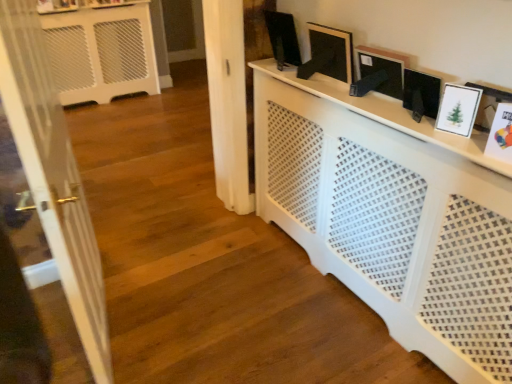
What do you see at coordinates (458, 109) in the screenshot? This screenshot has width=512, height=384. I see `white glossy picture frame at upper right, which is the 2th picture frame from front to back` at bounding box center [458, 109].

At what (x,y) coordinates should I click in order to perform the action: click on matte black picture frame at upper center, acting as the 5th picture frame starting from the front. Please return your answer as a coordinate pair (x, y). Looking at the image, I should click on (283, 38).

What is the approximate width of white matte picture frame at upper right, the 3th picture frame when ordered from right to left?

white matte picture frame at upper right, the 3th picture frame when ordered from right to left, is 4.86 inches in width.

Measure the distance between point (408,69) and camera.

Point (408,69) and camera are 4.94 feet apart.

Where is `white paper picture frame at right, which is counted as the fifth picture frame, starting from the left`? white paper picture frame at right, which is counted as the fifth picture frame, starting from the left is located at coordinates (501, 134).

The width and height of the screenshot is (512, 384). Describe the element at coordinates (391, 221) in the screenshot. I see `white perforated radiator at center` at that location.

Find the location of a particular element. white glossy picture frame at upper right, which is the 2th picture frame from front to back is located at coordinates (458, 109).

From the image's perspective, which one is positioned higher, white perforated radiator at center or white paper picture frame at right, which is the fifth picture frame from back to front?

white paper picture frame at right, which is the fifth picture frame from back to front, appears higher in the image.

What's the angular difference between white perforated radiator at center and white paper picture frame at right, which is the first picture frame in front-to-back order,'s facing directions?

The facing directions of white perforated radiator at center and white paper picture frame at right, which is the first picture frame in front-to-back order, are 0.00296 degrees apart.

Is white perforated radiator at center oriented towards white paper picture frame at right, which is counted as the fifth picture frame, starting from the left?

No, white perforated radiator at center is not turned towards white paper picture frame at right, which is counted as the fifth picture frame, starting from the left.

Between white perforated radiator at center and white paper picture frame at right, which is the first picture frame in front-to-back order, which one has more height?

With more height is white perforated radiator at center.

From a real-world perspective, which is physically above, white paper picture frame at right, which is the fifth picture frame from back to front, or black matte picture frame at upper center, which is counted as the 4th picture frame, starting from the front?

In real-world perspective, black matte picture frame at upper center, which is counted as the 4th picture frame, starting from the front, is above.

Is white paper picture frame at right, positioned as the first picture frame in right-to-left order, at the right side of black matte picture frame at upper center, placed as the fourth picture frame when sorted from right to left?

Yes.

Does point (503, 124) come closer to viewer compared to point (310, 65)?

Yes.

Does white paper picture frame at right, which is the fifth picture frame from back to front, have a lesser width compared to black matte picture frame at upper center, which is the second picture frame from left to right?

In fact, white paper picture frame at right, which is the fifth picture frame from back to front, might be wider than black matte picture frame at upper center, which is the second picture frame from left to right.

From the picture: Who is bigger, white matte picture frame at upper right, which is the 3th picture frame in left-to-right order, or black matte picture frame at upper center, which is the second picture frame from left to right?

black matte picture frame at upper center, which is the second picture frame from left to right, is bigger.

Which point is more forward, (407, 74) or (318, 38)?

The point (407, 74) is more forward.

Is white matte picture frame at upper right, which is the 3th picture frame in left-to-right order, in front of or behind black matte picture frame at upper center, positioned as the 2th picture frame in back-to-front order, in the image?

white matte picture frame at upper right, which is the 3th picture frame in left-to-right order, is in front of black matte picture frame at upper center, positioned as the 2th picture frame in back-to-front order.

From the image's perspective, is white glossy picture frame at upper right, the 4th picture frame from the left, on top of matte black picture frame at upper center, acting as the 5th picture frame starting from the front?

Actually, white glossy picture frame at upper right, the 4th picture frame from the left, appears below matte black picture frame at upper center, acting as the 5th picture frame starting from the front, in the image.

Consider the image. Considering their positions, is white glossy picture frame at upper right, the 4th picture frame from the left, located in front of or behind matte black picture frame at upper center, acting as the 1th picture frame starting from the back?

white glossy picture frame at upper right, the 4th picture frame from the left, is in front of matte black picture frame at upper center, acting as the 1th picture frame starting from the back.

Is white glossy picture frame at upper right, which is the fourth picture frame in back-to-front order, touching matte black picture frame at upper center, the first picture frame when ordered from left to right?

They are not placed beside each other.

Considering the relative sizes of white glossy picture frame at upper right, the 4th picture frame from the left, and matte black picture frame at upper center, acting as the 5th picture frame starting from the front, in the image provided, is white glossy picture frame at upper right, the 4th picture frame from the left, wider than matte black picture frame at upper center, acting as the 5th picture frame starting from the front,?

No.

Which is more to the right, white glossy picture frame at upper right, which is counted as the second picture frame, starting from the right, or white glossy door at left?

white glossy picture frame at upper right, which is counted as the second picture frame, starting from the right, is more to the right.

Between white glossy picture frame at upper right, which is the 2th picture frame from front to back, and white glossy door at left, which one has less height?

With less height is white glossy picture frame at upper right, which is the 2th picture frame from front to back.

Is white glossy picture frame at upper right, which is the fourth picture frame in back-to-front order, not within white glossy door at left?

Indeed, white glossy picture frame at upper right, which is the fourth picture frame in back-to-front order, is completely outside white glossy door at left.

Is white glossy door at left completely or partially inside white paper picture frame at right, which is the first picture frame in front-to-back order?

Actually, white glossy door at left is outside white paper picture frame at right, which is the first picture frame in front-to-back order.

Is white paper picture frame at right, which is the first picture frame in front-to-back order, positioned before white glossy door at left?

No.

Between white paper picture frame at right, positioned as the first picture frame in right-to-left order, and white glossy door at left, which one has larger size?

white glossy door at left is bigger.

Locate an element on the screen. This screenshot has height=384, width=512. the 1st picture frame behind the white glossy door at left, starting your count from the anchor is located at coordinates (501, 134).

Are white glossy picture frame at upper right, which is the 2th picture frame from front to back, and black matte picture frame at upper center, which is counted as the 4th picture frame, starting from the front, beside each other?

They are not placed beside each other.

Is white glossy picture frame at upper right, which is counted as the second picture frame, starting from the right, aimed at black matte picture frame at upper center, which is the second picture frame from left to right?

No, white glossy picture frame at upper right, which is counted as the second picture frame, starting from the right, is not oriented towards black matte picture frame at upper center, which is the second picture frame from left to right.

Is black matte picture frame at upper center, which is the second picture frame from left to right, surrounded by white glossy picture frame at upper right, which is counted as the second picture frame, starting from the right?

No, black matte picture frame at upper center, which is the second picture frame from left to right, is located outside of white glossy picture frame at upper right, which is counted as the second picture frame, starting from the right.

Can you confirm if white glossy picture frame at upper right, which is counted as the second picture frame, starting from the right, is shorter than black matte picture frame at upper center, placed as the fourth picture frame when sorted from right to left?

Indeed, white glossy picture frame at upper right, which is counted as the second picture frame, starting from the right, has a lesser height compared to black matte picture frame at upper center, placed as the fourth picture frame when sorted from right to left.

At what (x,y) coordinates should I click in order to perform the action: click on furniture on the left side of white paper picture frame at right, which is the first picture frame in front-to-back order. Please return your answer as a coordinate pair (x, y). The image size is (512, 384). Looking at the image, I should click on (391, 221).

Starting from the black matte picture frame at upper center, placed as the fourth picture frame when sorted from right to left, which picture frame is the 3rd one in front? Please provide its 2D coordinates.

[(501, 134)]

Which object lies nearer to the anchor point white glossy door at left, white matte picture frame at upper right, which is the 3th picture frame from front to back, or matte black picture frame at upper center, acting as the 5th picture frame starting from the front?

matte black picture frame at upper center, acting as the 5th picture frame starting from the front, lies closer to white glossy door at left than the other object.

Which object lies nearer to the anchor point white glossy picture frame at upper right, which is the 2th picture frame from front to back, black matte picture frame at upper center, which is counted as the 4th picture frame, starting from the front, or white glossy door at left?

black matte picture frame at upper center, which is counted as the 4th picture frame, starting from the front, lies closer to white glossy picture frame at upper right, which is the 2th picture frame from front to back, than the other object.

When comparing their distances from black matte picture frame at upper center, which is the second picture frame from left to right, does white paper picture frame at right, which is the fifth picture frame from back to front, or matte black picture frame at upper center, acting as the 1th picture frame starting from the back, seem further?

white paper picture frame at right, which is the fifth picture frame from back to front, lies further to black matte picture frame at upper center, which is the second picture frame from left to right, than the other object.

Considering their positions, is white matte picture frame at upper right, which is the 3th picture frame from front to back, positioned closer to white paper picture frame at right, positioned as the first picture frame in right-to-left order, than white glossy picture frame at upper right, the 4th picture frame from the left?

Based on the image, white glossy picture frame at upper right, the 4th picture frame from the left, appears to be nearer to white paper picture frame at right, positioned as the first picture frame in right-to-left order.

From the image, which object appears to be nearer to matte black picture frame at upper center, acting as the 5th picture frame starting from the front, white glossy picture frame at upper right, the 4th picture frame from the left, or white paper picture frame at right, which is counted as the fifth picture frame, starting from the left?

white glossy picture frame at upper right, the 4th picture frame from the left, is closer to matte black picture frame at upper center, acting as the 5th picture frame starting from the front.

Based on their spatial positions, is white glossy picture frame at upper right, the 4th picture frame from the left, or matte black picture frame at upper center, acting as the 5th picture frame starting from the front, closer to white glossy door at left?

The object closer to white glossy door at left is matte black picture frame at upper center, acting as the 5th picture frame starting from the front.

Considering their positions, is black matte picture frame at upper center, which is counted as the 4th picture frame, starting from the front, positioned closer to white glossy picture frame at upper right, which is the fourth picture frame in back-to-front order, than white perforated radiator at center?

Among the two, white perforated radiator at center is located nearer to white glossy picture frame at upper right, which is the fourth picture frame in back-to-front order.

From the image, which object appears to be nearer to black matte picture frame at upper center, placed as the fourth picture frame when sorted from right to left, white glossy door at left or white perforated radiator at center?

Based on the image, white perforated radiator at center appears to be nearer to black matte picture frame at upper center, placed as the fourth picture frame when sorted from right to left.

Identify the location of furniture between white glossy door at left and white matte picture frame at upper right, the 3th picture frame positioned from the back, from left to right. This screenshot has width=512, height=384. click(x=391, y=221).

Where is `picture frame located between white glossy picture frame at upper right, the 4th picture frame from the left, and black matte picture frame at upper center, which is the second picture frame from left to right, in the depth direction`? The image size is (512, 384). picture frame located between white glossy picture frame at upper right, the 4th picture frame from the left, and black matte picture frame at upper center, which is the second picture frame from left to right, in the depth direction is located at coordinates (421, 94).

The width and height of the screenshot is (512, 384). Identify the location of furniture between white glossy door at left and white paper picture frame at right, which is the fifth picture frame from back to front, in the horizontal direction. (391, 221).

The height and width of the screenshot is (384, 512). What are the coordinates of `furniture between white glossy door at left and white glossy picture frame at upper right, the 4th picture frame from the left` in the screenshot? It's located at (x=391, y=221).